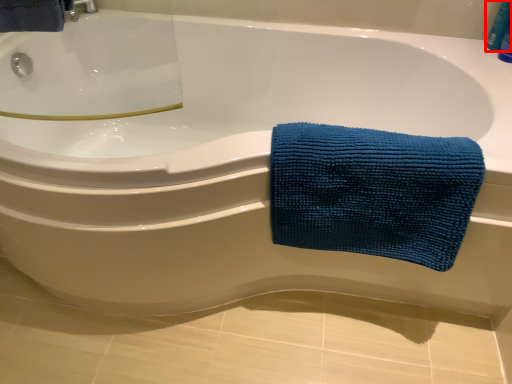
Question: In this image, where is toiletry (annotated by the red box) located relative to towel?

Choices:
 (A) right
 (B) left

Answer: (A)